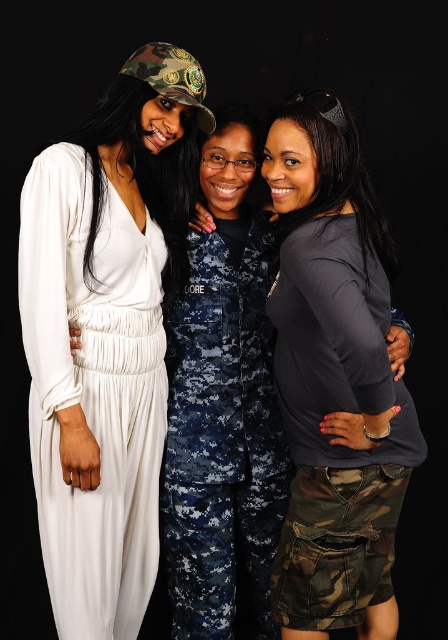
You are a photographer arranging three people for a photo shoot. You notice the dark gray matte shirt at center and the white silky dress at left. Which clothing item is positioned higher in the image?

The dark gray matte shirt at center is above the white silky dress at left, so it is positioned higher in the image.

You are standing 5 feet away from the camera. You want to take a photo of the dark gray matte shirt at center. Can you reach it without moving your position?

The dark gray matte shirt at center is 4.30 feet away from the camera. Since you are standing 5 feet away from the camera, you are farther than the shirt, so you cannot reach it without moving closer.